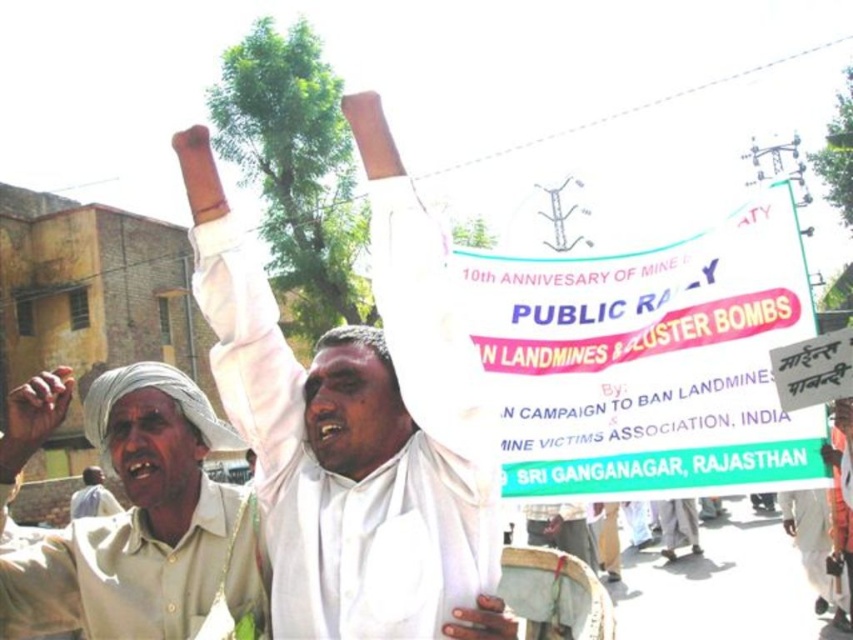
Question: Does white cloth at center appear over light beige fabric turban at lower left?

Choices:
 (A) yes
 (B) no

Answer: (A)

Question: Is beige cotton shirt at upper left bigger than light beige fabric turban at lower left?

Choices:
 (A) no
 (B) yes

Answer: (B)

Question: Among these objects, which one is nearest to the camera?

Choices:
 (A) light beige fabric turban at lower left
 (B) beige cotton shirt at upper left
 (C) white cloth at center

Answer: (C)

Question: Which object is positioned farthest from the light beige fabric turban at lower left?

Choices:
 (A) beige cotton shirt at upper left
 (B) white cloth at center

Answer: (B)

Question: Which of the following is the closest to the observer?

Choices:
 (A) white cloth at center
 (B) beige cotton shirt at upper left

Answer: (A)

Question: Can you confirm if white cloth at center is positioned above light beige fabric turban at lower left?

Choices:
 (A) no
 (B) yes

Answer: (B)